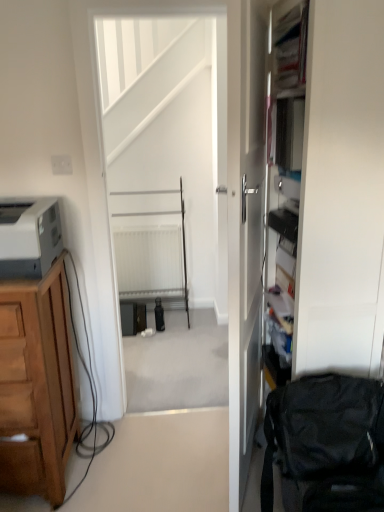
Describe the element at coordinates (166, 153) in the screenshot. This screenshot has height=512, width=384. I see `white matte screen door at center` at that location.

What do you see at coordinates (36, 386) in the screenshot?
I see `brown wooden cabinet at left` at bounding box center [36, 386].

Where is `white glossy door at center`? white glossy door at center is located at coordinates (245, 228).

Locate an element on the screen. This screenshot has height=512, width=384. matte gray printer at left is located at coordinates (29, 238).

Identify the location of white matte screen door at center. The width and height of the screenshot is (384, 512). (166, 153).

Is point (4, 277) behind point (263, 77)?

No.

In terms of size, does matte gray printer at left appear bigger or smaller than white glossy door at center?

Clearly, matte gray printer at left is smaller in size than white glossy door at center.

From the picture: Is matte gray printer at left oriented away from white glossy door at center?

No.

Which of these two, white plastic radiator at center or white plastic electric outlet at upper left, is wider?

With larger width is white plastic radiator at center.

How different are the orientations of white plastic radiator at center and white plastic electric outlet at upper left in degrees?

The facing directions of white plastic radiator at center and white plastic electric outlet at upper left are 1.66 degrees apart.

Which is further, (166, 285) or (67, 165)?

The point (166, 285) is farther from the camera.

Is white plastic radiator at center shorter than white plastic electric outlet at upper left?

No, white plastic radiator at center is not shorter than white plastic electric outlet at upper left.

Can you confirm if black fabric swivel chair at lower right is positioned to the left of white plastic radiator at center?

Incorrect, black fabric swivel chair at lower right is not on the left side of white plastic radiator at center.

Considering the positions of points (291, 468) and (122, 242), is point (291, 468) farther from camera compared to point (122, 242)?

No, it is in front of (122, 242).

Is black fabric swivel chair at lower right facing towards white plastic radiator at center?

No, black fabric swivel chair at lower right is not turned towards white plastic radiator at center.

Who is bigger, matte gray printer at left or white plastic radiator at center?

white plastic radiator at center.

From the image's perspective, is matte gray printer at left located above white plastic radiator at center?

Yes, from the image's perspective, matte gray printer at left is over white plastic radiator at center.

Is matte gray printer at left wider than white plastic radiator at center?

Yes, matte gray printer at left is wider than white plastic radiator at center.

Is the surface of matte gray printer at left in direct contact with white plastic radiator at center?

No, matte gray printer at left is not touching white plastic radiator at center.

From a real-world perspective, which object rests below the other?

From a 3D spatial view, white plastic radiator at center is below.

How different are the orientations of white plastic radiator at center and matte gray printer at left in degrees?

0.941 degrees separate the facing orientations of white plastic radiator at center and matte gray printer at left.

Is matte gray printer at left inside white plastic radiator at center?

No, matte gray printer at left is not inside white plastic radiator at center.

From the image's perspective, which is below, white plastic radiator at center or matte gray printer at left?

white plastic radiator at center.

Is white matte screen door at center positioned behind black fabric swivel chair at lower right?

That is True.

Who is smaller, white matte screen door at center or black fabric swivel chair at lower right?

black fabric swivel chair at lower right.

Which is less distant, (133,27) or (289,405)?

Point (133,27) is farther from the camera than point (289,405).

From a real-world perspective, which object rests below the other?

In real-world perspective, black fabric swivel chair at lower right is lower.

Does white matte screen door at center have a smaller size compared to brown wooden cabinet at left?

Yes, white matte screen door at center is smaller than brown wooden cabinet at left.

Looking at their sizes, would you say white matte screen door at center is wider or thinner than brown wooden cabinet at left?

Considering their sizes, white matte screen door at center looks slimmer than brown wooden cabinet at left.

Is white matte screen door at center in front of or behind brown wooden cabinet at left in the image?

In the image, white matte screen door at center appears behind brown wooden cabinet at left.

In the image, is white matte screen door at center on the left side or the right side of brown wooden cabinet at left?

white matte screen door at center is to the right of brown wooden cabinet at left.

Where is `door on the right of matte gray printer at left`? The height and width of the screenshot is (512, 384). door on the right of matte gray printer at left is located at coordinates (245, 228).

Identify the location of radiator located below the white plastic electric outlet at upper left (from the image's perspective). The height and width of the screenshot is (512, 384). (149, 262).

Estimate the real-world distances between objects in this image. Which object is further from matte gray printer at left, white plastic radiator at center or black fabric swivel chair at lower right?

white plastic radiator at center is positioned further to the anchor matte gray printer at left.

Based on their spatial positions, is white glossy door at center or brown wooden cabinet at left further from black fabric swivel chair at lower right?

Among the two, brown wooden cabinet at left is located further to black fabric swivel chair at lower right.

From the image, which object appears to be farther from brown wooden cabinet at left, white glossy door at center or black fabric swivel chair at lower right?

black fabric swivel chair at lower right lies further to brown wooden cabinet at left than the other object.

Based on their spatial positions, is white plastic radiator at center or white plastic electric outlet at upper left closer to white matte screen door at center?

Among the two, white plastic radiator at center is located nearer to white matte screen door at center.

Based on the photo, considering their positions, is white plastic radiator at center positioned further to brown wooden cabinet at left than matte gray printer at left?

Based on the image, white plastic radiator at center appears to be further to brown wooden cabinet at left.

Which object lies nearer to the anchor point white matte screen door at center, white plastic electric outlet at upper left or black fabric swivel chair at lower right?

The object closer to white matte screen door at center is white plastic electric outlet at upper left.

In the scene shown: From the image, which object appears to be nearer to black fabric swivel chair at lower right, brown wooden cabinet at left or white plastic radiator at center?

brown wooden cabinet at left lies closer to black fabric swivel chair at lower right than the other object.

Considering their positions, is white plastic electric outlet at upper left positioned closer to brown wooden cabinet at left than white matte screen door at center?

The object closer to brown wooden cabinet at left is white plastic electric outlet at upper left.

Where is `door between matte gray printer at left and black fabric swivel chair at lower right in the horizontal direction`? This screenshot has height=512, width=384. door between matte gray printer at left and black fabric swivel chair at lower right in the horizontal direction is located at coordinates (245, 228).

Identify the location of screen door between matte gray printer at left and white glossy door at center in the horizontal direction. [x=166, y=153].

Where is `screen door between brown wooden cabinet at left and white glossy door at center in the horizontal direction`? Image resolution: width=384 pixels, height=512 pixels. screen door between brown wooden cabinet at left and white glossy door at center in the horizontal direction is located at coordinates (166, 153).

Where is `electric outlet located between brown wooden cabinet at left and white plastic radiator at center in the depth direction`? The width and height of the screenshot is (384, 512). electric outlet located between brown wooden cabinet at left and white plastic radiator at center in the depth direction is located at coordinates (61, 165).